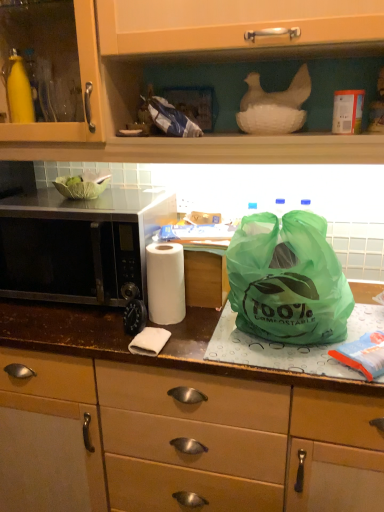
Question: Which direction should I rotate to face green plastic bag at center, the first cabinetry in the bottom-to-top sequence, — up or down?

Choices:
 (A) down
 (B) up

Answer: (A)

Question: Can you confirm if green compostable bag at center is taller than matte wood cabinet at upper center, the first cabinetry from the top?

Choices:
 (A) no
 (B) yes

Answer: (A)

Question: Is green compostable bag at center far from matte wood cabinet at upper center, the first cabinetry from the top?

Choices:
 (A) no
 (B) yes

Answer: (A)

Question: Is green compostable bag at center outside of matte wood cabinet at upper center, the first cabinetry from the top?

Choices:
 (A) yes
 (B) no

Answer: (A)

Question: Does green compostable bag at center lie behind matte wood cabinet at upper center, placed as the second cabinetry when sorted from bottom to top?

Choices:
 (A) no
 (B) yes

Answer: (B)

Question: From a real-world perspective, is green compostable bag at center below matte wood cabinet at upper center, the first cabinetry from the top?

Choices:
 (A) no
 (B) yes

Answer: (B)

Question: Considering the relative sizes of green compostable bag at center and matte wood cabinet at upper center, placed as the second cabinetry when sorted from bottom to top, in the image provided, is green compostable bag at center bigger than matte wood cabinet at upper center, placed as the second cabinetry when sorted from bottom to top,?

Choices:
 (A) yes
 (B) no

Answer: (B)

Question: Can you confirm if matte wood cabinet at upper center, placed as the second cabinetry when sorted from bottom to top, is taller than green compostable bag at center?

Choices:
 (A) no
 (B) yes

Answer: (B)

Question: Can you confirm if matte wood cabinet at upper center, the first cabinetry from the top, is bigger than green compostable bag at center?

Choices:
 (A) no
 (B) yes

Answer: (B)

Question: Can you see matte wood cabinet at upper center, placed as the second cabinetry when sorted from bottom to top, touching green compostable bag at center?

Choices:
 (A) yes
 (B) no

Answer: (B)

Question: Could you tell me if matte wood cabinet at upper center, the first cabinetry from the top, is turned towards green compostable bag at center?

Choices:
 (A) no
 (B) yes

Answer: (A)

Question: From the image's perspective, is matte wood cabinet at upper center, placed as the second cabinetry when sorted from bottom to top, on green compostable bag at center?

Choices:
 (A) yes
 (B) no

Answer: (A)

Question: Does matte wood cabinet at upper center, placed as the second cabinetry when sorted from bottom to top, appear on the left side of green compostable bag at center?

Choices:
 (A) no
 (B) yes

Answer: (B)

Question: Are green plastic bag at center, the first cabinetry in the bottom-to-top sequence, and matte wood cabinet at upper center, the first cabinetry from the top, beside each other?

Choices:
 (A) no
 (B) yes

Answer: (A)